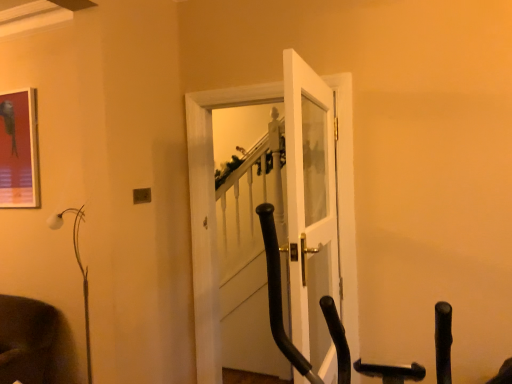
Question: Based on their sizes in the image, would you say metallic glossy picture frame at upper left is bigger or smaller than white matte floor lamp at left?

Choices:
 (A) small
 (B) big

Answer: (A)

Question: Would you say metallic glossy picture frame at upper left is inside or outside white matte floor lamp at left?

Choices:
 (A) outside
 (B) inside

Answer: (A)

Question: Considering the real-world distances, which object is farthest from the white matte floor lamp at left?

Choices:
 (A) white glass door at center, the 2th door viewed from the back
 (B) white glossy door at center, which is the 2th door from front to back
 (C) metallic glossy picture frame at upper left

Answer: (A)

Question: Which is nearer to the white glossy door at center, placed as the 1th door when sorted from back to front?

Choices:
 (A) metallic glossy picture frame at upper left
 (B) white glass door at center, the 2th door viewed from the back
 (C) white matte floor lamp at left

Answer: (B)